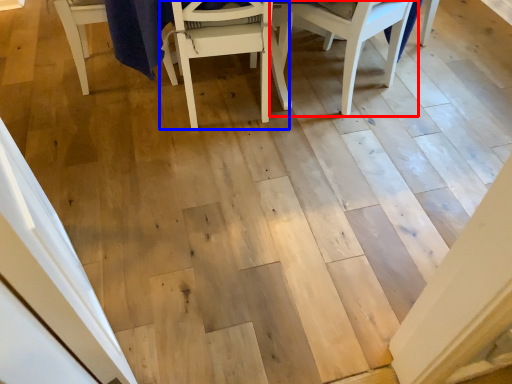
Question: Which object is closer to the camera taking this photo, chair (highlighted by a red box) or chair (highlighted by a blue box)?

Choices:
 (A) chair
 (B) chair

Answer: (B)